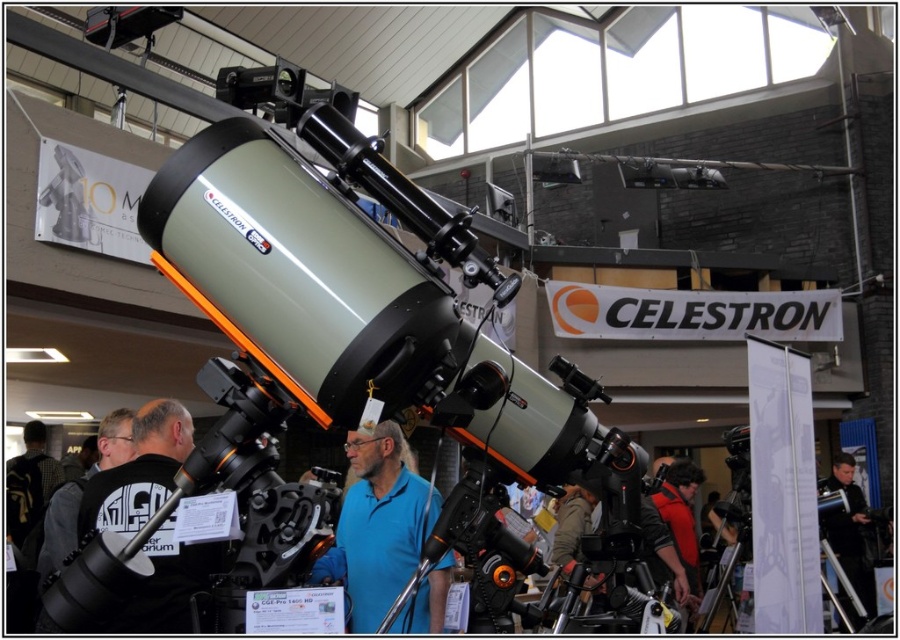
Measure the distance between blue matte shirt at center and black fabric shirt at center.

A distance of 38.19 inches exists between blue matte shirt at center and black fabric shirt at center.

Does point (394, 486) come in front of point (182, 452)?

No, (394, 486) is behind (182, 452).

Identify the location of blue matte shirt at center. (381, 522).

Is blue matte shirt at center to the left of black matte jacket at center from the viewer's perspective?

Indeed, blue matte shirt at center is positioned on the left side of black matte jacket at center.

Who is taller, blue matte shirt at center or black matte jacket at center?

With more height is black matte jacket at center.

Find the location of `blue matte shirt at center`. blue matte shirt at center is located at coordinates (381, 522).

Between point (150, 554) and point (833, 472), which one is positioned in front?

Positioned in front is point (150, 554).

Which is more to the right, black fabric shirt at center or black matte jacket at center?

From the viewer's perspective, black matte jacket at center appears more on the right side.

Is point (153, 467) behind point (846, 513)?

That is False.

This screenshot has height=640, width=900. I want to click on black fabric shirt at center, so click(140, 472).